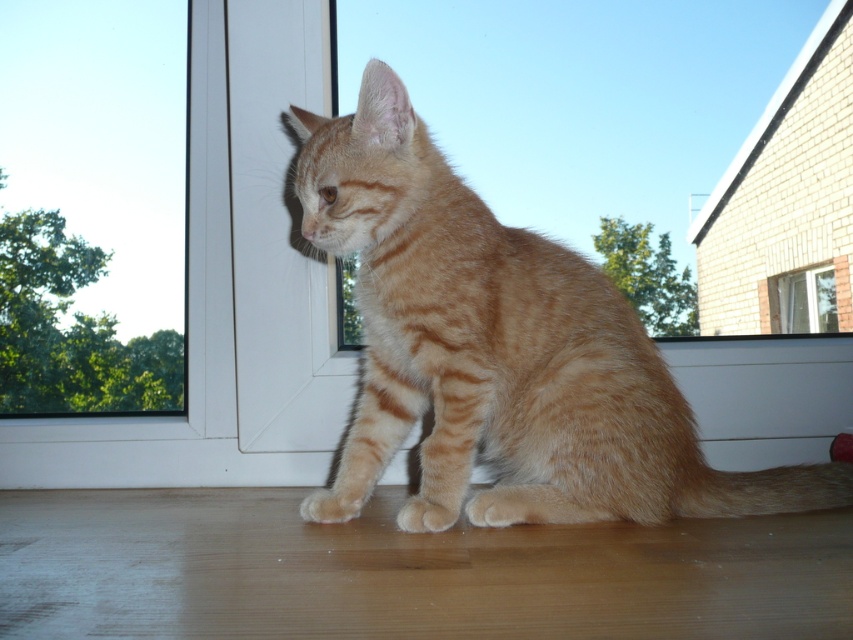
You are a small robot with a width of 1 meter. You are in a room and want to move from the transparent glass window at upper left to the transparent glass window at upper right. Can you fit through the space between them without touching either window?

The distance between the transparent glass window at upper left and transparent glass window at upper right is 1.12 meters. Since the robot is 1 meter wide, it can fit through the space between them without touching either window.